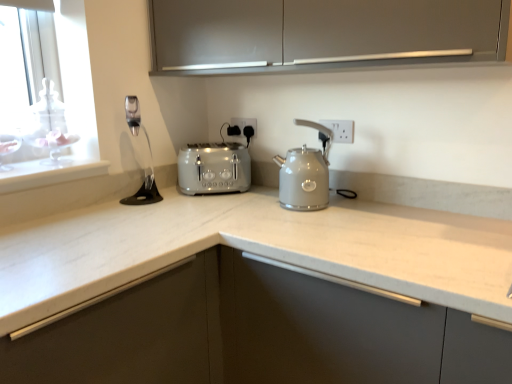
Question: Looking at their shapes, would you say white plastic electric outlet at upper center, which appears as the second electric outlet when viewed from the front, is wider or thinner than satin finish cabinet at upper center?

Choices:
 (A) thin
 (B) wide

Answer: (A)

Question: Is white plastic electric outlet at upper center, which appears as the first electric outlet when viewed from the back, bigger or smaller than satin finish cabinet at upper center?

Choices:
 (A) small
 (B) big

Answer: (A)

Question: Considering the real-world distances, which object is farthest from the satin nickel faucet at upper left?

Choices:
 (A) white plastic electric outlet at upper right, which is the second electric outlet in back-to-front order
 (B) satin grey kettle at center
 (C) white plastic electric outlet at upper center, acting as the 1th electric outlet starting from the left
 (D) satin silver toaster at center
 (E) satin finish cabinet at upper center

Answer: (A)

Question: Estimate the real-world distances between objects in this image. Which object is farther from the white plastic electric outlet at upper right, which is the second electric outlet in back-to-front order?

Choices:
 (A) satin nickel faucet at upper left
 (B) satin grey kettle at center
 (C) satin finish cabinet at upper center
 (D) satin silver toaster at center
 (E) white plastic electric outlet at upper center, acting as the 1th electric outlet starting from the left

Answer: (A)